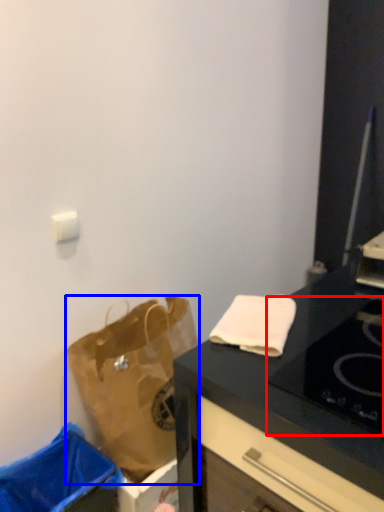
Question: Which object appears closest to the camera in this image, gas stove (highlighted by a red box) or handbag (highlighted by a blue box)?

Choices:
 (A) gas stove
 (B) handbag

Answer: (A)